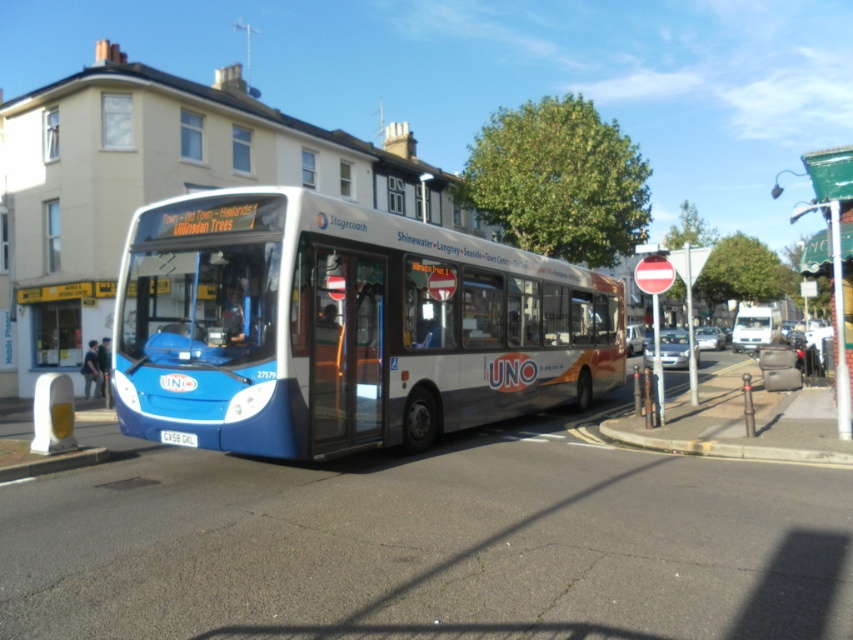
You are a pedestrian standing on the sidewalk next to the blue metallic bus at center. You want to cross the street to reach the white glossy van at right. Is the van behind or in front of the bus?

The blue metallic bus at center is in front of the white glossy van at right, so the van is behind the bus.

You are a delivery person who needs to unload a package from the blue metallic bus at center. The gray concrete curb at lower right is where you need to place the package. Can you reach the curb without moving the bus?

The blue metallic bus at center is 3.95 meters away from the gray concrete curb at lower right. Since the distance is sufficient, you can easily reach the curb without needing to move the bus.

You are standing at the front of the Stagecoach UNO bus and want to know where the gray concrete curb at lower right is located. Can you provide its coordinates?

The gray concrete curb at lower right is located at point (724, 448).